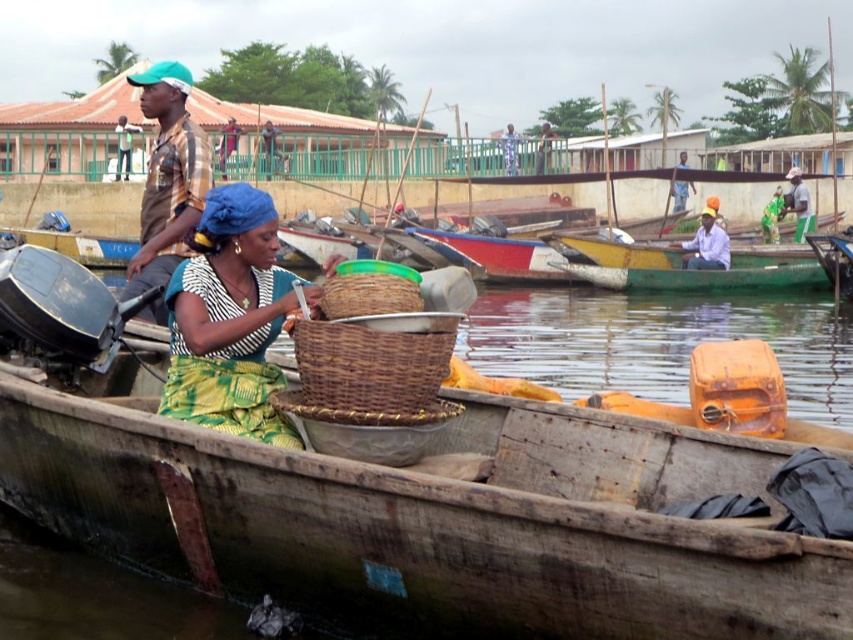
Question: Where is matte yellow shirt at left located in relation to light blue fabric headscarf at upper center in the image?

Choices:
 (A) below
 (B) above

Answer: (A)

Question: Which of the following is the farthest from the observer?

Choices:
 (A) brown woven basket at center
 (B) green fabric headscarf at upper center
 (C) blue fabric headscarf at upper center

Answer: (C)

Question: Is green fabric shirt at upper left bigger than matte blue hat at upper center?

Choices:
 (A) no
 (B) yes

Answer: (A)

Question: Which of the following is the farthest from the observer?

Choices:
 (A) matte yellow shirt at left
 (B) light blue fabric headscarf at upper center
 (C) green woven basket at center

Answer: (B)

Question: Which point is farther to the camera?

Choices:
 (A) blue fabric headscarf at upper center
 (B) light blue fabric headscarf at upper center
 (C) orange plastic container at lower right
 (D) matte blue hat at upper center

Answer: (A)

Question: Can you confirm if woven brown basket at center is bigger than light blue fabric headscarf at upper center?

Choices:
 (A) no
 (B) yes

Answer: (A)